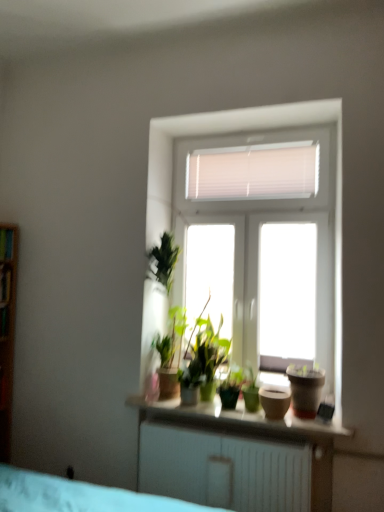
The image size is (384, 512). Describe the element at coordinates (5, 284) in the screenshot. I see `transparent glass window at upper center` at that location.

What do you see at coordinates (305, 389) in the screenshot? Image resolution: width=384 pixels, height=512 pixels. I see `matte brown pot at right, positioned as the first flowerpot in right-to-left order` at bounding box center [305, 389].

Describe the element at coordinates (275, 401) in the screenshot. I see `matte brown pot at center, which is counted as the first flowerpot, starting from the left` at that location.

The width and height of the screenshot is (384, 512). Describe the element at coordinates (4, 321) in the screenshot. I see `wooden shelf at left, positioned as the 1th shelf in bottom-to-top order` at that location.

Image resolution: width=384 pixels, height=512 pixels. Describe the element at coordinates (237, 420) in the screenshot. I see `smooth white shelf at center` at that location.

Describe the element at coordinates (250, 391) in the screenshot. The image size is (384, 512). I see `green matte houseplant at center` at that location.

The image size is (384, 512). What do you see at coordinates (8, 243) in the screenshot?
I see `wooden shelf at left, placed as the first shelf when sorted from top to bottom` at bounding box center [8, 243].

Where is `transparent glass window at upper center`? transparent glass window at upper center is located at coordinates (5, 284).

Locate an element on the screen. flowerpot positioned vertically above the green matte houseplant at center (from a real-world perspective) is located at coordinates (305, 389).

Considering the sizes of matte brown pot at right, which is counted as the second flowerpot, starting from the left, and green matte houseplant at center in the image, is matte brown pot at right, which is counted as the second flowerpot, starting from the left, bigger or smaller than green matte houseplant at center?

In the image, matte brown pot at right, which is counted as the second flowerpot, starting from the left, appears to be larger than green matte houseplant at center.

From a real-world perspective, which is physically below, matte brown pot at right, positioned as the first flowerpot in right-to-left order, or green matte houseplant at center?

In real-world perspective, green matte houseplant at center is lower.

Is matte brown pot at right, positioned as the first flowerpot in right-to-left order, surrounded by transparent glass window at upper center?

No, matte brown pot at right, positioned as the first flowerpot in right-to-left order, is not inside transparent glass window at upper center.

From the image's perspective, between transparent glass window at upper center and matte brown pot at right, which is counted as the second flowerpot, starting from the left, who is located below?

matte brown pot at right, which is counted as the second flowerpot, starting from the left, is shown below in the image.

Is matte brown pot at right, which is counted as the second flowerpot, starting from the left, at the back of transparent glass window at upper center?

That's not correct — transparent glass window at upper center is not looking away from matte brown pot at right, which is counted as the second flowerpot, starting from the left.

Consider the image. From a real-world perspective, between transparent glass window at upper center and matte brown pot at right, which is counted as the second flowerpot, starting from the left, who is vertically higher?

In real-world perspective, transparent glass window at upper center is above.

Is smooth white shelf at center bigger than green matte houseplant at center?

Yes.

Are smooth white shelf at center and green matte houseplant at center making contact?

smooth white shelf at center and green matte houseplant at center are clearly separated.

Considering the relative sizes of smooth white shelf at center and green matte houseplant at center in the image provided, is smooth white shelf at center thinner than green matte houseplant at center?

No.

From a real-world perspective, is matte brown pot at right, positioned as the first flowerpot in right-to-left order, positioned over smooth white shelf at center based on gravity?

Yes, from a real-world perspective, matte brown pot at right, positioned as the first flowerpot in right-to-left order, is over smooth white shelf at center

From the image's perspective, is matte brown pot at right, which is counted as the second flowerpot, starting from the left, below smooth white shelf at center?

Actually, matte brown pot at right, which is counted as the second flowerpot, starting from the left, appears above smooth white shelf at center in the image.

Considering the positions of objects matte brown pot at right, positioned as the first flowerpot in right-to-left order, and smooth white shelf at center in the image provided, who is more to the right, matte brown pot at right, positioned as the first flowerpot in right-to-left order, or smooth white shelf at center?

From the viewer's perspective, matte brown pot at right, positioned as the first flowerpot in right-to-left order, appears more on the right side.

Where is `window sill located underneath the wooden shelf at left, positioned as the 1th shelf in bottom-to-top order (from a real-world perspective)`? window sill located underneath the wooden shelf at left, positioned as the 1th shelf in bottom-to-top order (from a real-world perspective) is located at coordinates (237, 420).

From a real-world perspective, is wooden shelf at left, which is the 2th shelf in top-to-bottom order, physically below smooth white shelf at center?

No, from a real-world perspective, wooden shelf at left, which is the 2th shelf in top-to-bottom order, is not under smooth white shelf at center.

Consider the image. Considering the positions of objects wooden shelf at left, positioned as the 1th shelf in bottom-to-top order, and smooth white shelf at center in the image provided, who is more to the left, wooden shelf at left, positioned as the 1th shelf in bottom-to-top order, or smooth white shelf at center?

From the viewer's perspective, wooden shelf at left, positioned as the 1th shelf in bottom-to-top order, appears more on the left side.

In terms of width, does smooth white shelf at center look wider or thinner when compared to wooden shelf at left, which is the 2th shelf in top-to-bottom order?

Clearly, smooth white shelf at center has more width compared to wooden shelf at left, which is the 2th shelf in top-to-bottom order.

Which of these two, smooth white shelf at center or wooden shelf at left, positioned as the 1th shelf in bottom-to-top order, stands shorter?

Standing shorter between the two is smooth white shelf at center.

Is smooth white shelf at center inside the boundaries of wooden shelf at left, which is the 2th shelf in top-to-bottom order, or outside?

smooth white shelf at center cannot be found inside wooden shelf at left, which is the 2th shelf in top-to-bottom order.

How many degrees apart are the facing directions of transparent glass window at upper center and wooden shelf at left, placed as the first shelf when sorted from top to bottom?

The facing directions of transparent glass window at upper center and wooden shelf at left, placed as the first shelf when sorted from top to bottom, are 2.7 degrees apart.

Is transparent glass window at upper center aimed at wooden shelf at left, arranged as the second shelf when ordered from the bottom?

No.

Which of these two, transparent glass window at upper center or wooden shelf at left, placed as the first shelf when sorted from top to bottom, stands taller?

transparent glass window at upper center is taller.

This screenshot has width=384, height=512. There is a green matte houseplant at center. What are the coordinates of `the 1st flowerpot below it (from the image's perspective)` in the screenshot? It's located at (305, 389).

The height and width of the screenshot is (512, 384). I want to click on window above the matte brown pot at right, positioned as the first flowerpot in right-to-left order (from a real-world perspective), so click(5, 284).

Estimate the real-world distances between objects in this image. Which object is closer to matte brown pot at right, which is counted as the second flowerpot, starting from the left, transparent glass window at upper center or wooden shelf at left, positioned as the 1th shelf in bottom-to-top order?

wooden shelf at left, positioned as the 1th shelf in bottom-to-top order, is closer to matte brown pot at right, which is counted as the second flowerpot, starting from the left.

From the image, which object appears to be nearer to wooden shelf at left, placed as the first shelf when sorted from top to bottom, matte brown pot at center, arranged as the second flowerpot when viewed from the right, or green matte houseplant at center?

green matte houseplant at center lies closer to wooden shelf at left, placed as the first shelf when sorted from top to bottom, than the other object.

Estimate the real-world distances between objects in this image. Which object is further from wooden shelf at left, placed as the first shelf when sorted from top to bottom, wooden shelf at left, positioned as the 1th shelf in bottom-to-top order, or smooth white shelf at center?

smooth white shelf at center is positioned further to the anchor wooden shelf at left, placed as the first shelf when sorted from top to bottom.

Looking at the image, which one is located further to wooden shelf at left, which is the 2th shelf in top-to-bottom order, matte brown pot at center, which is counted as the first flowerpot, starting from the left, or matte brown pot at right, which is counted as the second flowerpot, starting from the left?

matte brown pot at right, which is counted as the second flowerpot, starting from the left, is positioned further to the anchor wooden shelf at left, which is the 2th shelf in top-to-bottom order.

Looking at this image, based on their spatial positions, is wooden shelf at left, positioned as the 1th shelf in bottom-to-top order, or matte brown pot at right, positioned as the first flowerpot in right-to-left order, further from smooth white shelf at center?

Answer: The object further to smooth white shelf at center is wooden shelf at left, positioned as the 1th shelf in bottom-to-top order.

Estimate the real-world distances between objects in this image. Which object is closer to wooden shelf at left, placed as the first shelf when sorted from top to bottom, matte brown pot at right, positioned as the first flowerpot in right-to-left order, or green matte houseplant at center?

green matte houseplant at center lies closer to wooden shelf at left, placed as the first shelf when sorted from top to bottom, than the other object.

When comparing their distances from transparent glass window at upper center, does matte brown pot at right, positioned as the first flowerpot in right-to-left order, or matte brown pot at center, arranged as the second flowerpot when viewed from the right, seem further?

matte brown pot at right, positioned as the first flowerpot in right-to-left order, is positioned further to the anchor transparent glass window at upper center.

From the image, which object appears to be nearer to green matte houseplant at center, wooden shelf at left, positioned as the 1th shelf in bottom-to-top order, or matte brown pot at right, positioned as the first flowerpot in right-to-left order?

matte brown pot at right, positioned as the first flowerpot in right-to-left order, is positioned closer to the anchor green matte houseplant at center.

In order to click on houseplant located between wooden shelf at left, which is the 2th shelf in top-to-bottom order, and matte brown pot at center, which is counted as the first flowerpot, starting from the left, in the left-right direction in this screenshot , I will do `click(250, 391)`.

Find the location of `window sill between wooden shelf at left, positioned as the 1th shelf in bottom-to-top order, and matte brown pot at center, arranged as the second flowerpot when viewed from the right, from left to right`. window sill between wooden shelf at left, positioned as the 1th shelf in bottom-to-top order, and matte brown pot at center, arranged as the second flowerpot when viewed from the right, from left to right is located at coordinates (237, 420).

What are the coordinates of `window sill between transparent glass window at upper center and matte brown pot at center, arranged as the second flowerpot when viewed from the right, from left to right` in the screenshot? It's located at (237, 420).

You are a GUI agent. You are given a task and a screenshot of the screen. Output one action in this format:
    pyautogui.click(x=<x>, y=<y>)
    Task: Click on the window between wooden shelf at left, arranged as the second shelf when ordered from the bottom, and wooden shelf at left, which is the 2th shelf in top-to-bottom order, vertically
    Image resolution: width=384 pixels, height=512 pixels.
    Given the screenshot: What is the action you would take?
    pyautogui.click(x=5, y=284)